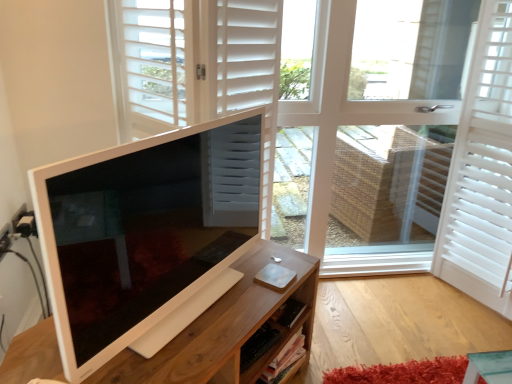
What do you see at coordinates (343, 117) in the screenshot? The width and height of the screenshot is (512, 384). I see `white matte window at center` at bounding box center [343, 117].

I want to click on white matte window at center, so click(343, 117).

Where is `white matte door at center`? white matte door at center is located at coordinates [x=195, y=67].

This screenshot has width=512, height=384. Describe the element at coordinates (143, 231) in the screenshot. I see `white glossy computer monitor at left` at that location.

What do you see at coordinates (224, 328) in the screenshot? This screenshot has width=512, height=384. I see `wooden desk at center` at bounding box center [224, 328].

At what (x,y) coordinates should I click in order to perform the action: click on white matte shutter at right. Please return your answer as a coordinate pair (x, y). The image size is (512, 384). Looking at the image, I should click on (482, 172).

Identify the location of white matte window at center. The width and height of the screenshot is (512, 384). (343, 117).

Who is smaller, white matte shutter at right or white matte window at center?

With smaller size is white matte shutter at right.

What's the angular difference between white matte shutter at right and white matte window at center's facing directions?

The angular difference between white matte shutter at right and white matte window at center is 72.8 degrees.

Is white matte shutter at right positioned in front of white matte window at center?

Yes.

Based on the photo, is white matte shutter at right next to white matte window at center and touching it?

They are not placed beside each other.

Is wooden desk at center positioned with its back to white matte window at center?

No.

Considering the sizes of objects wooden desk at center and white matte window at center in the image provided, who is shorter, wooden desk at center or white matte window at center?

wooden desk at center is shorter.

From a real-world perspective, is wooden desk at center physically above white matte window at center?

No, from a real-world perspective, wooden desk at center is not on top of white matte window at center.

Between wooden desk at center and white matte window at center, which one appears on the left side from the viewer's perspective?

wooden desk at center.

Consider the image. Visually, is white matte window at center positioned to the left or to the right of white matte shutter at right?

In the image, white matte window at center appears on the left side of white matte shutter at right.

From the picture: Considering the relative sizes of white matte window at center and white matte shutter at right in the image provided, is white matte window at center smaller than white matte shutter at right?

Actually, white matte window at center might be larger than white matte shutter at right.

Are white matte window at center and white matte shutter at right far apart?

No, there isn't a large distance between white matte window at center and white matte shutter at right.

In the scene shown: Which of these two, white matte window at center or white matte shutter at right, stands taller?

With more height is white matte window at center.

Is white glossy computer monitor at left at the left side of white matte shutter at right?

Correct, you'll find white glossy computer monitor at left to the left of white matte shutter at right.

Considering their positions, is white glossy computer monitor at left located in front of or behind white matte shutter at right?

Visually, white glossy computer monitor at left is located in front of white matte shutter at right.

You are a GUI agent. You are given a task and a screenshot of the screen. Output one action in this format:
    pyautogui.click(x=<x>, y=<y>)
    Task: Click on the shutter above the white glossy computer monitor at left (from the image's perspective)
    
    Given the screenshot: What is the action you would take?
    pyautogui.click(x=482, y=172)

Is point (62, 270) closer to camera compared to point (507, 137)?

Yes, it is in front of point (507, 137).

In the scene shown: Can you confirm if white glossy computer monitor at left is taller than white matte window at center?

In fact, white glossy computer monitor at left may be shorter than white matte window at center.

How many degrees apart are the facing directions of white glossy computer monitor at left and white matte window at center?

The angular difference between white glossy computer monitor at left and white matte window at center is 50 degrees.

Considering the relative positions of white glossy computer monitor at left and white matte window at center in the image provided, is white glossy computer monitor at left in front of white matte window at center?

Yes.

Could you tell me if white glossy computer monitor at left is facing white matte window at center?

No, white glossy computer monitor at left is not turned towards white matte window at center.

How many degrees apart are the facing directions of wooden desk at center and white matte door at center?

33.8 degrees.

Who is bigger, wooden desk at center or white matte door at center?

white matte door at center is bigger.

Which object is closer to the camera, wooden desk at center or white matte door at center?

wooden desk at center is closer to the camera.

Would you say wooden desk at center is to the left or to the right of white matte door at center in the picture?

wooden desk at center is to the left of white matte door at center.

From a real-world perspective, is white matte shutter at right positioned under wooden desk at center based on gravity?

Incorrect, from a real-world perspective, white matte shutter at right is higher than wooden desk at center.

What's the angular difference between white matte shutter at right and wooden desk at center's facing directions?

121 degrees separate the facing orientations of white matte shutter at right and wooden desk at center.

From the image's perspective, would you say white matte shutter at right is shown under wooden desk at center?

No, from the image's perspective, white matte shutter at right is not below wooden desk at center.

Considering the positions of objects white matte shutter at right and wooden desk at center in the image provided, who is more to the right, white matte shutter at right or wooden desk at center?

Positioned to the right is white matte shutter at right.

The image size is (512, 384). Identify the location of shutter that appears below the white matte window at center (from the image's perspective). (482, 172).

Locate an element on the screen. window on the right of the wooden desk at center is located at coordinates (343, 117).

Estimate the real-world distances between objects in this image. Which object is closer to white matte shutter at right, wooden desk at center or white glossy computer monitor at left?

Based on the image, wooden desk at center appears to be nearer to white matte shutter at right.

Looking at this image, which object lies nearer to the anchor point white matte door at center, wooden desk at center or white matte shutter at right?

wooden desk at center.

Based on their spatial positions, is white matte window at center or white matte door at center further from white matte shutter at right?

Based on the image, white matte door at center appears to be further to white matte shutter at right.

Looking at the image, which one is located further to wooden desk at center, white matte door at center or white glossy computer monitor at left?

Among the two, white matte door at center is located further to wooden desk at center.

Looking at the image, which one is located further to wooden desk at center, white glossy computer monitor at left or white matte shutter at right?

white matte shutter at right lies further to wooden desk at center than the other object.

Estimate the real-world distances between objects in this image. Which object is further from white matte shutter at right, white glossy computer monitor at left or white matte door at center?

The object further to white matte shutter at right is white glossy computer monitor at left.

When comparing their distances from white matte door at center, does white matte window at center or white glossy computer monitor at left seem further?

white matte window at center lies further to white matte door at center than the other object.

Which object lies further to the anchor point white matte shutter at right, white matte door at center or white glossy computer monitor at left?

white glossy computer monitor at left is further to white matte shutter at right.

At what (x,y) coordinates should I click in order to perform the action: click on door between white matte window at center and wooden desk at center from top to bottom. Please return your answer as a coordinate pair (x, y). The image size is (512, 384). Looking at the image, I should click on (195, 67).

You are a GUI agent. You are given a task and a screenshot of the screen. Output one action in this format:
    pyautogui.click(x=<x>, y=<y>)
    Task: Click on the window between white glossy computer monitor at left and white matte shutter at right
    This screenshot has width=512, height=384.
    Given the screenshot: What is the action you would take?
    pyautogui.click(x=343, y=117)

Locate an element on the screen. This screenshot has width=512, height=384. computer monitor that lies between white matte door at center and wooden desk at center from top to bottom is located at coordinates (143, 231).

Where is `door between wooden desk at center and white matte shutter at right in the horizontal direction`? The height and width of the screenshot is (384, 512). door between wooden desk at center and white matte shutter at right in the horizontal direction is located at coordinates (195, 67).